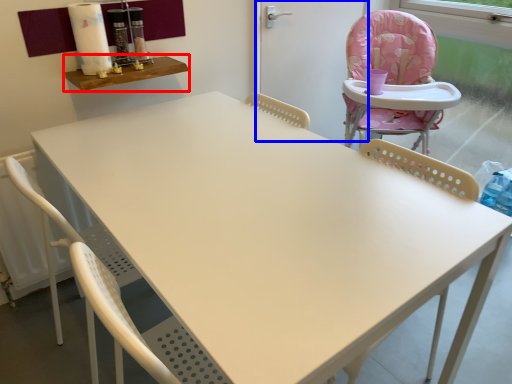
Question: Which object appears closest to the camera in this image, table (highlighted by a red box) or screen door (highlighted by a blue box)?

Choices:
 (A) table
 (B) screen door

Answer: (A)